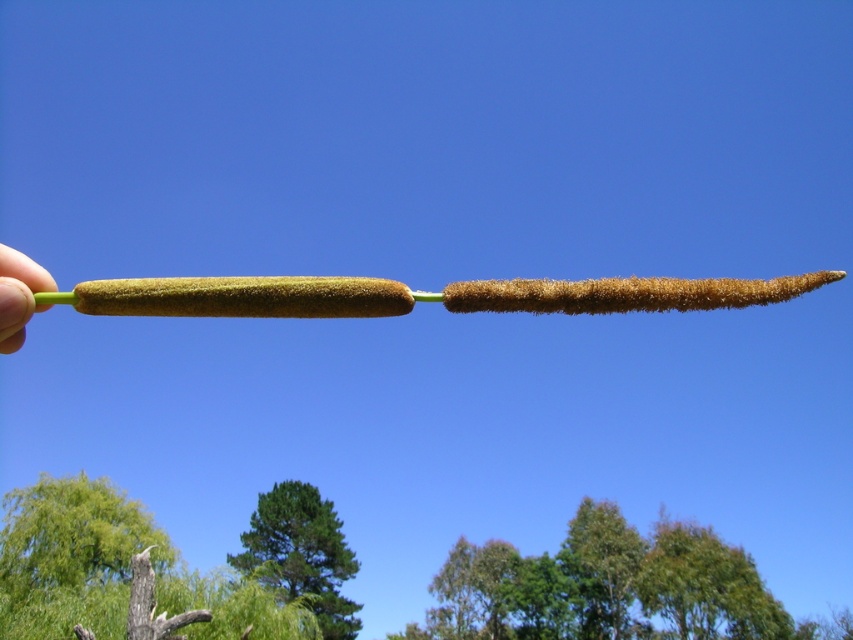
You are standing in a field looking at two plant structures. The first is a shorter, rounded one on the left, and the second is a longer, tapered one on the right. Behind them, there are various trees. A green leafy tree is located at a specific coordinate point. Can you identify which tree is at point (611, 588)?

The point (611, 588) corresponds to the green leafy tree at upper center.

You are standing in a garden and want to water both the green leafy tree at upper center and the green flesh at left. Which one should you water first if you want to start with the closer one?

You should water the green leafy tree at upper center first because it is closer to you than the green flesh at left.